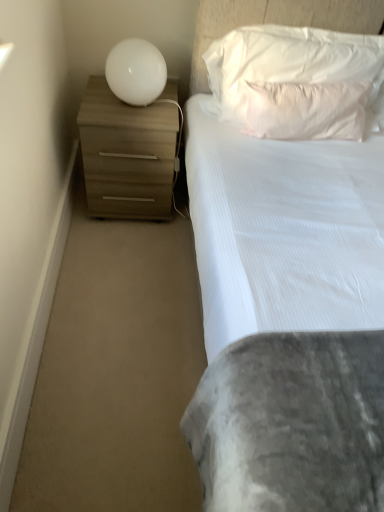
Question: From the image's perspective, is matte wood chest of drawers at left over white soft pillow at upper center, placed as the 2th pillow when sorted from bottom to top?

Choices:
 (A) no
 (B) yes

Answer: (A)

Question: Can you confirm if matte wood chest of drawers at left is wider than white soft pillow at upper center, placed as the 2th pillow when sorted from bottom to top?

Choices:
 (A) yes
 (B) no

Answer: (A)

Question: From the image's perspective, is matte wood chest of drawers at left located beneath white soft pillow at upper center, the first pillow in the top-to-bottom sequence?

Choices:
 (A) no
 (B) yes

Answer: (B)

Question: Considering the relative sizes of matte wood chest of drawers at left and white soft pillow at upper center, the first pillow in the top-to-bottom sequence, in the image provided, is matte wood chest of drawers at left taller than white soft pillow at upper center, the first pillow in the top-to-bottom sequence,?

Choices:
 (A) no
 (B) yes

Answer: (B)

Question: Considering the relative positions of matte wood chest of drawers at left and white soft pillow at upper center, the first pillow in the top-to-bottom sequence, in the image provided, is matte wood chest of drawers at left to the right of white soft pillow at upper center, the first pillow in the top-to-bottom sequence, from the viewer's perspective?

Choices:
 (A) no
 (B) yes

Answer: (A)

Question: From a real-world perspective, is white glossy sphere at upper left above or below white textured pillow at upper center, the 2th pillow viewed from the top?

Choices:
 (A) above
 (B) below

Answer: (A)

Question: In the image, is white glossy sphere at upper left on the left side or the right side of white textured pillow at upper center, the 2th pillow viewed from the top?

Choices:
 (A) left
 (B) right

Answer: (A)

Question: From their relative heights in the image, would you say white glossy sphere at upper left is taller or shorter than white textured pillow at upper center, the 2th pillow viewed from the top?

Choices:
 (A) tall
 (B) short

Answer: (A)

Question: Is point (107, 67) positioned closer to the camera than point (263, 114)?

Choices:
 (A) farther
 (B) closer

Answer: (A)

Question: From the image's perspective, is matte wood chest of drawers at left above or below white soft pillow at upper center, placed as the 2th pillow when sorted from bottom to top?

Choices:
 (A) below
 (B) above

Answer: (A)

Question: Considering the positions of matte wood chest of drawers at left and white soft pillow at upper center, placed as the 2th pillow when sorted from bottom to top, in the image, is matte wood chest of drawers at left wider or thinner than white soft pillow at upper center, placed as the 2th pillow when sorted from bottom to top,?

Choices:
 (A) thin
 (B) wide

Answer: (B)

Question: From a real-world perspective, relative to white soft pillow at upper center, the first pillow in the top-to-bottom sequence, is matte wood chest of drawers at left vertically above or below?

Choices:
 (A) below
 (B) above

Answer: (A)

Question: Considering the relative positions of matte wood chest of drawers at left and white soft pillow at upper center, placed as the 2th pillow when sorted from bottom to top, in the image provided, is matte wood chest of drawers at left to the left or to the right of white soft pillow at upper center, placed as the 2th pillow when sorted from bottom to top,?

Choices:
 (A) right
 (B) left

Answer: (B)

Question: In terms of height, does white soft pillow at upper center, the first pillow in the top-to-bottom sequence, look taller or shorter compared to white textured pillow at upper center, the 1th pillow positioned from the bottom?

Choices:
 (A) short
 (B) tall

Answer: (B)

Question: In terms of width, does white soft pillow at upper center, placed as the 2th pillow when sorted from bottom to top, look wider or thinner when compared to white textured pillow at upper center, the 2th pillow viewed from the top?

Choices:
 (A) thin
 (B) wide

Answer: (B)